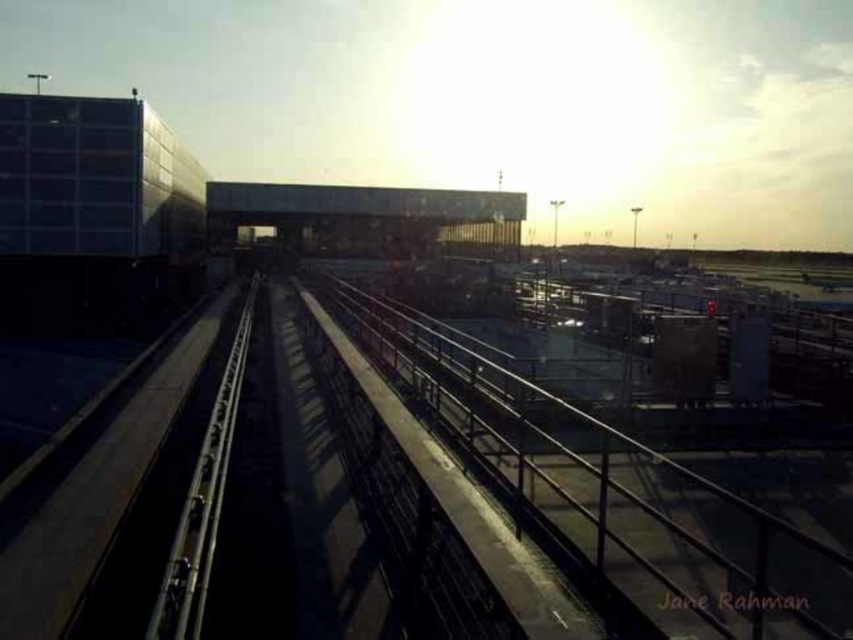
You are a maintenance worker assigned to inspect the metallic gray train track at center and the metallic smooth train track at center. Your supervisor asks if the two tracks are far enough apart to allow a standard monorail vehicle to pass safely. According to safety regulations, the minimum distance between parallel tracks should be at least 90 meters. Can you confirm if the current distance meets this requirement?

The distance between the metallic gray train track at center and the metallic smooth train track at center is 91.71 meters, which exceeds the minimum requirement of 90 meters. Therefore, the current distance meets the safety regulations for a standard monorail vehicle to pass safely.

You are a maintenance worker needing to inspect both the dark gray concrete overpass at center and the metallic smooth train track at center. According to the scene, which object is positioned to the east of the other?

The dark gray concrete overpass at center is to the right of the metallic smooth train track at center. Since the sun is low in the sky during sunset, the shadows suggest the light is coming from the west. Therefore, the metallic smooth train track at center is positioned to the east of the dark gray concrete overpass at center.

You are standing at the entrance of the airport terminal and want to find the metallic gray train track at center. According to the scene description, where should you look in relation to the monorail track?

The metallic gray train track at center is located at point [614,493] in the scene, so you should look towards the center area near the bottom left diagonal direction where the track runs towards the center.